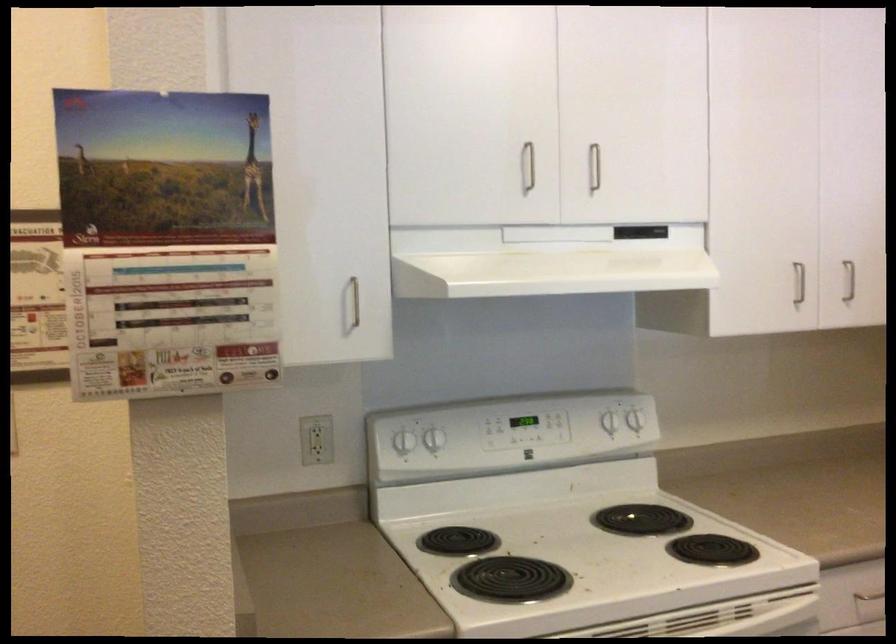
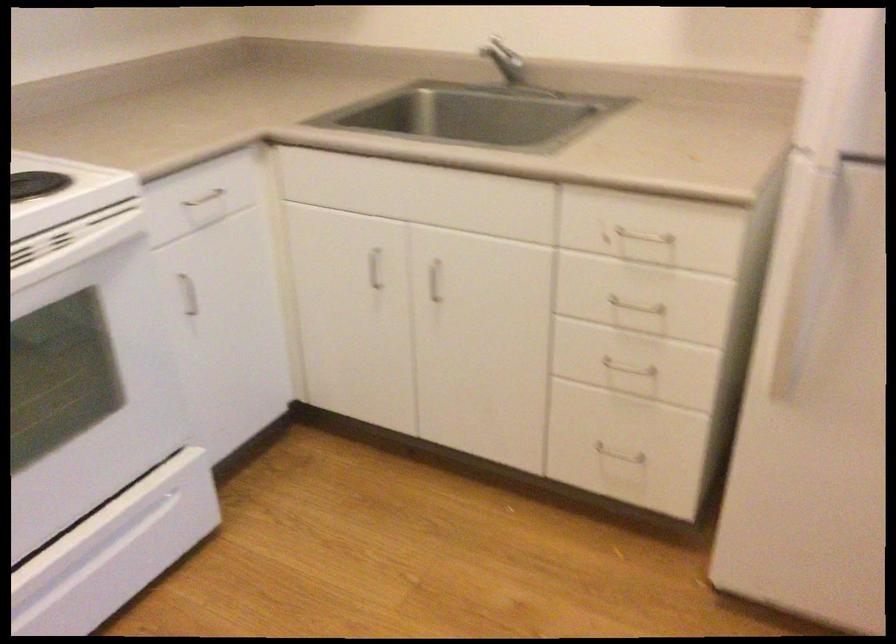
How did the camera likely rotate?

The camera rotated toward right-down.